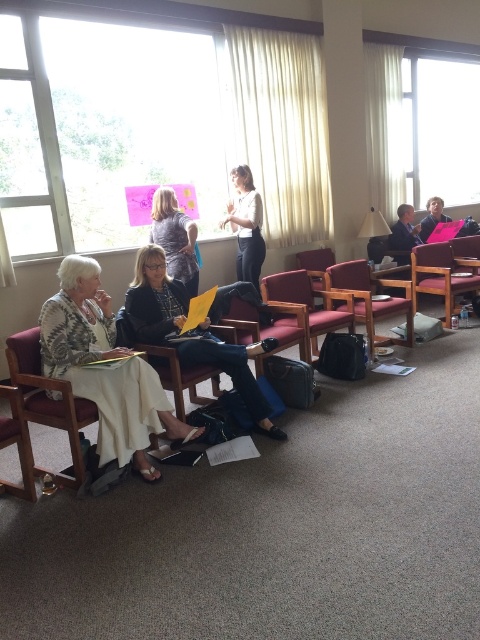
Consider the image. You are standing at the point at coordinates point (238, 164) in the conference room. You want to walk to the door that is 5.10 meters away from you. Is there enough space for you to move freely towards the door?

The distance between you and the door is 5.10 meters, so there is enough space to move freely towards the door as long as there are no obstacles in your path.

You are an office worker who needs to sit down. You see the leather armchair at center and the matte gray shirt at center. Which object can you sit on?

The leather armchair at center can be sat on, while the matte gray shirt at center is clothing and cannot be sat on.

You are a photographer setting up a shoot in this conference room. You need to position a 1.8m tall mannequin wearing a white textured dress at center so that it stands out against the brown leather armchair at center. Based on the scene description, will the mannequin be taller than the chair?

The white textured dress at center has a greater height compared to brown leather armchair at center, so yes, the mannequin wearing the white textured dress at center will be taller than the brown leather armchair at center.